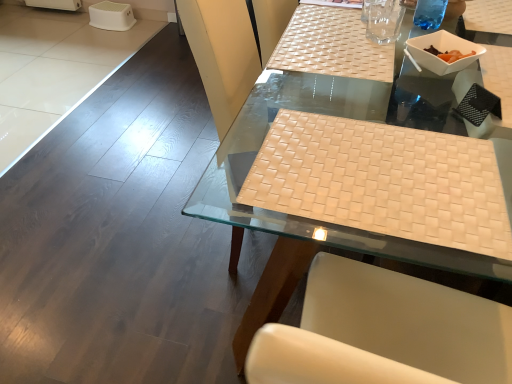
Image resolution: width=512 pixels, height=384 pixels. What are the coordinates of `beige woven mat at center` in the screenshot? It's located at (382, 181).

Identify the location of white plastic bowl at upper right. This screenshot has height=384, width=512. (442, 50).

This screenshot has width=512, height=384. What do you see at coordinates (383, 20) in the screenshot? I see `transparent glass at upper center` at bounding box center [383, 20].

Where is `beige woven mat at center`? This screenshot has width=512, height=384. beige woven mat at center is located at coordinates (382, 181).

Considering the positions of point (370, 20) and point (446, 45), is point (370, 20) closer or farther from the camera than point (446, 45)?

Point (370, 20) is farther from the camera than point (446, 45).

Where is `bowl located in front of the transparent glass at upper center`? bowl located in front of the transparent glass at upper center is located at coordinates (442, 50).

From the image's perspective, which object appears higher, transparent glass at upper center or white plastic bowl at upper right?

From the image's view, transparent glass at upper center is above.

Is transparent glass at upper center positioned beyond the bounds of white plastic bowl at upper right?

transparent glass at upper center is positioned outside white plastic bowl at upper right.

Which of these two, white plastic bowl at upper right or beige woven mat at center, is thinner?

white plastic bowl at upper right.

How different are the orientations of white plastic bowl at upper right and beige woven mat at center in degrees?

white plastic bowl at upper right and beige woven mat at center are facing 138 degrees away from each other.

At what (x,y) coordinates should I click in order to perform the action: click on wide located underneath the white plastic bowl at upper right (from a real-world perspective). Please return your answer as a coordinate pair (x, y). The image size is (512, 384). Looking at the image, I should click on (382, 181).

In the scene shown: Which point is more distant from viewer, (426, 55) or (463, 217)?

Positioned behind is point (426, 55).

From a real-world perspective, which is physically below, white woven placemat at center or beige woven mat at center?

white woven placemat at center.

Who is more distant, white woven placemat at center or beige woven mat at center?

beige woven mat at center.

Can you confirm if white woven placemat at center is positioned to the left of beige woven mat at center?

Incorrect, white woven placemat at center is not on the left side of beige woven mat at center.

Is white woven placemat at center oriented towards beige woven mat at center?

No.

Is transparent glass at upper center not inside transparent plastic cup at upper right?

Absolutely, transparent glass at upper center is external to transparent plastic cup at upper right.

Considering the relative sizes of transparent glass at upper center and transparent plastic cup at upper right in the image provided, is transparent glass at upper center smaller than transparent plastic cup at upper right?

Yes.

From a real-world perspective, between transparent glass at upper center and transparent plastic cup at upper right, who is vertically higher?

transparent glass at upper center, from a real-world perspective.

Can you tell me how much transparent glass at upper center and transparent plastic cup at upper right differ in facing direction?

transparent glass at upper center and transparent plastic cup at upper right are facing 3.67 degrees away from each other.

Who is more distant, beige woven mat at center or white woven placemat at center?

beige woven mat at center is further from the camera.

In terms of height, does beige woven mat at center look taller or shorter compared to white woven placemat at center?

beige woven mat at center is shorter than white woven placemat at center.

Which object is wider, beige woven mat at center or white woven placemat at center?

white woven placemat at center is wider.

Between beige woven mat at center and transparent glass at upper center, which one has less height?

Standing shorter between the two is beige woven mat at center.

Locate an element on the screen. The width and height of the screenshot is (512, 384). wide in front of the transparent glass at upper center is located at coordinates (382, 181).

Consider the image. From a real-world perspective, which is physically below, beige woven mat at center or transparent glass at upper center?

beige woven mat at center, from a real-world perspective.

Does beige woven mat at center have a smaller size compared to transparent glass at upper center?

Incorrect, beige woven mat at center is not smaller in size than transparent glass at upper center.

From the image's perspective, would you say transparent plastic cup at upper right is shown under white plastic bowl at upper right?

Actually, transparent plastic cup at upper right appears above white plastic bowl at upper right in the image.

From a real-world perspective, is transparent plastic cup at upper right positioned above or below white plastic bowl at upper right?

transparent plastic cup at upper right is situated higher than white plastic bowl at upper right in the real world.

Who is shorter, transparent plastic cup at upper right or white plastic bowl at upper right?

white plastic bowl at upper right.

The width and height of the screenshot is (512, 384). I want to click on clear above the white plastic bowl at upper right (from the image's perspective), so click(383, 20).

You are a GUI agent. You are given a task and a screenshot of the screen. Output one action in this format:
    pyautogui.click(x=<x>, y=<y>)
    Task: Click on the bowl on the right of beige woven mat at center
    This screenshot has height=384, width=512.
    Given the screenshot: What is the action you would take?
    pyautogui.click(x=442, y=50)

Which object lies nearer to the anchor point beige woven mat at center, transparent glass at upper center or transparent plastic cup at upper right?

transparent glass at upper center is positioned closer to the anchor beige woven mat at center.

Looking at the image, which one is located further to transparent glass at upper center, beige woven mat at center or transparent plastic cup at upper right?

Based on the image, beige woven mat at center appears to be further to transparent glass at upper center.

Based on their spatial positions, is white woven placemat at center or transparent glass at upper center further from transparent plastic cup at upper right?

The object further to transparent plastic cup at upper right is white woven placemat at center.

Considering their positions, is beige woven mat at center positioned closer to white plastic bowl at upper right than transparent plastic cup at upper right?

transparent plastic cup at upper right lies closer to white plastic bowl at upper right than the other object.

Which object lies nearer to the anchor point white woven placemat at center, white plastic bowl at upper right or beige woven mat at center?

beige woven mat at center.

Estimate the real-world distances between objects in this image. Which object is closer to beige woven mat at center, white plastic bowl at upper right or transparent plastic cup at upper right?

white plastic bowl at upper right is closer to beige woven mat at center.

Looking at the image, which one is located closer to beige woven mat at center, transparent plastic cup at upper right or transparent glass at upper center?

Based on the image, transparent glass at upper center appears to be nearer to beige woven mat at center.

Estimate the real-world distances between objects in this image. Which object is closer to white plastic bowl at upper right, transparent glass at upper center or white woven placemat at center?

transparent glass at upper center is positioned closer to the anchor white plastic bowl at upper right.

The width and height of the screenshot is (512, 384). I want to click on clear between white woven placemat at center and transparent plastic cup at upper right along the z-axis, so click(x=383, y=20).

At what (x,y) coordinates should I click in order to perform the action: click on wide between white woven placemat at center and transparent plastic cup at upper right from front to back. Please return your answer as a coordinate pair (x, y). Image resolution: width=512 pixels, height=384 pixels. Looking at the image, I should click on (382, 181).

Find the location of a particular element. bowl between white woven placemat at center and transparent glass at upper center along the z-axis is located at coordinates (442, 50).

The image size is (512, 384). Identify the location of wide positioned between white woven placemat at center and white plastic bowl at upper right from near to far. (382, 181).